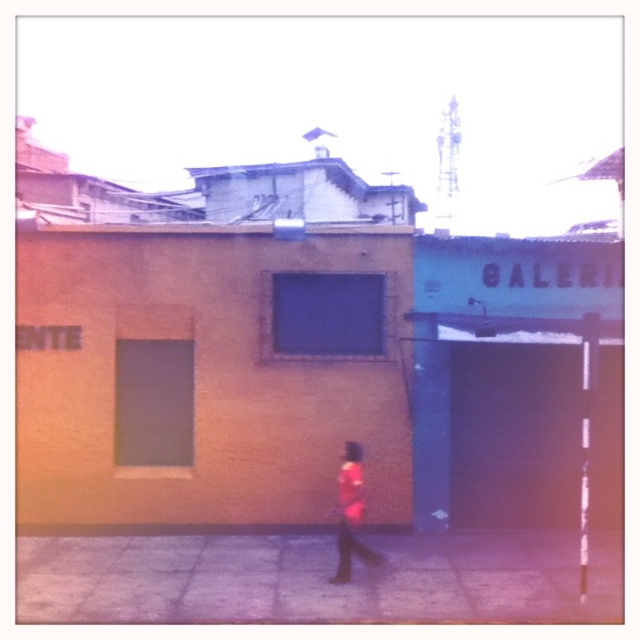
In the scene shown: You are standing at the center of the street and see the matte orange wall at center and the pink fabric dress at center. Which object is closer to you?

The matte orange wall at center is 6.29 feet away from the pink fabric dress at center, so the pink fabric dress at center is closer to you since it is positioned between you and the wall.